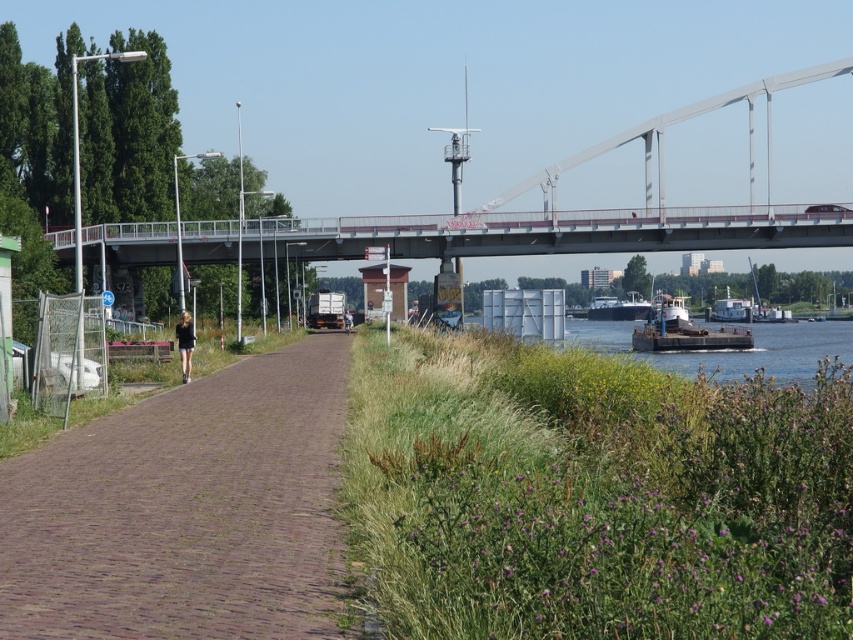
You are a photographer planning to capture the metallic gray bridge at upper center and the white matte barge at lower right in a single frame. Given their relative sizes, which object should you position closer to the center of your camera frame to ensure both are adequately visible?

Since the metallic gray bridge at upper center is wider than the white matte barge at lower right, you should position the metallic gray bridge at upper center closer to the center of your camera frame to ensure both are adequately visible.

You are a tourist standing on the riverside pathway and want to take a photo of both the white matte barge at lower right and the dark gray metallic barge at lower center. Since you only have a wide angle lens, which barge should you focus on to ensure both are in frame?

You should focus on the white matte barge at lower right because it is closer to the viewer than the dark gray metallic barge at lower center, allowing both to be captured within the wide angle lens frame.